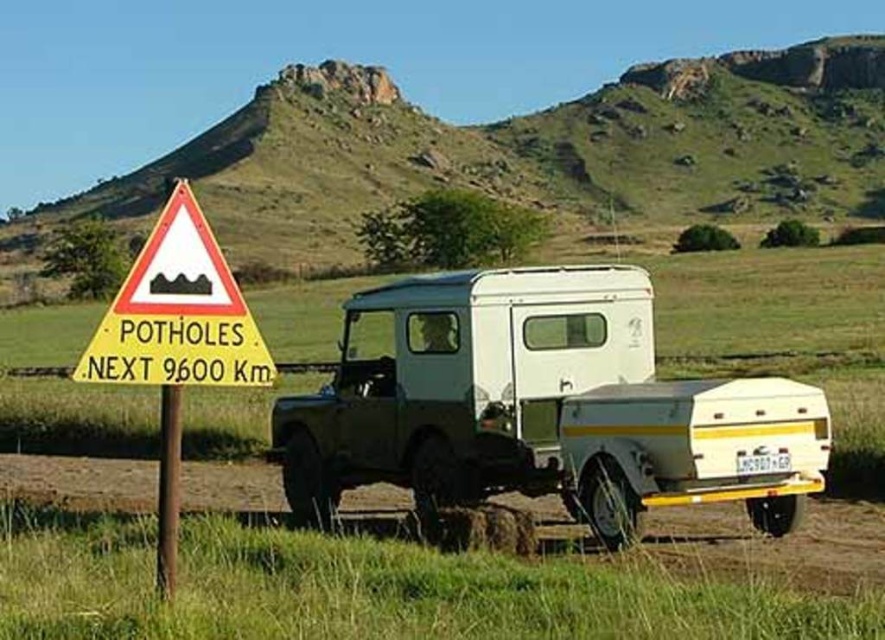
Between white matte recreational vehicle at center and yellow triangular sign at left, which one is positioned lower?

white matte recreational vehicle at center

What do you see at coordinates (541, 406) in the screenshot? I see `white matte recreational vehicle at center` at bounding box center [541, 406].

At what (x,y) coordinates should I click in order to perform the action: click on white matte recreational vehicle at center. Please return your answer as a coordinate pair (x, y). The width and height of the screenshot is (885, 640). Looking at the image, I should click on (541, 406).

Describe the element at coordinates (775, 541) in the screenshot. The image size is (885, 640). I see `brown dirt track at lower center` at that location.

Between point (801, 577) and point (185, 339), which one is positioned in front?

Point (185, 339) is in front.

The height and width of the screenshot is (640, 885). Identify the location of brown dirt track at lower center. (775, 541).

Does point (364, 332) lie in front of point (776, 564)?

No.

Between white matte recreational vehicle at center and brown dirt track at lower center, which one has more height?

white matte recreational vehicle at center

Describe the element at coordinates (541, 406) in the screenshot. I see `white matte recreational vehicle at center` at that location.

Identify the location of white matte recreational vehicle at center. This screenshot has width=885, height=640. (541, 406).